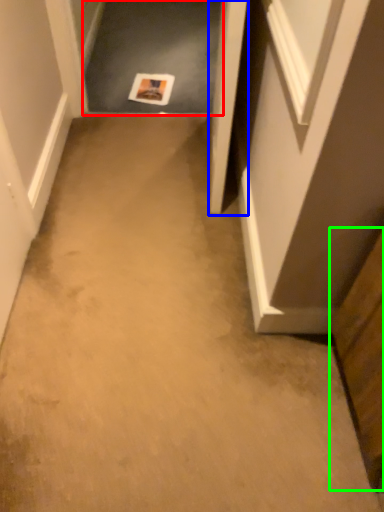
Question: Considering the real-world distances, which object is farthest from passage (highlighted by a red box)? door (highlighted by a blue box) or cabinetry (highlighted by a green box)?

Choices:
 (A) door
 (B) cabinetry

Answer: (B)